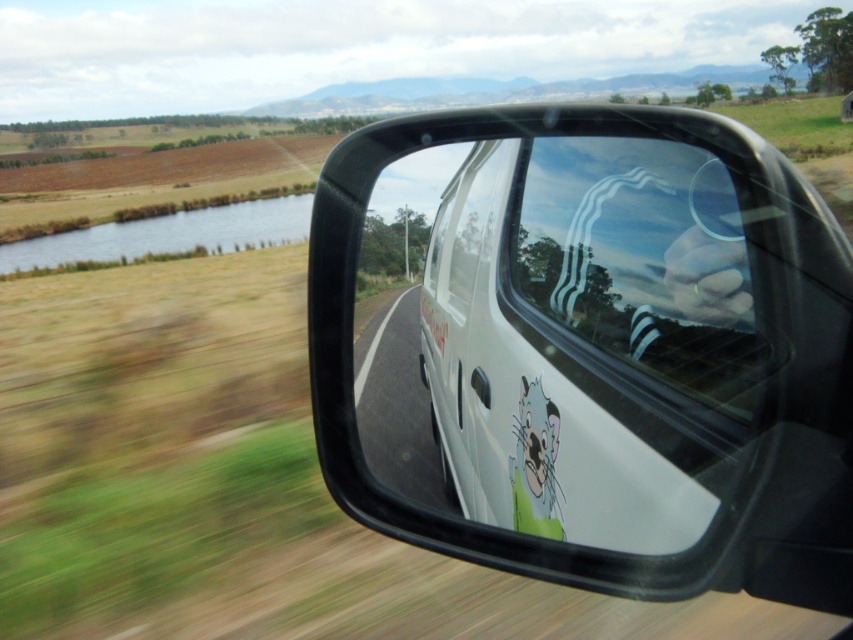
Is clear glass window at center to the right of cartoon cat sticker at lower center from the viewer's perspective?

Indeed, clear glass window at center is positioned on the right side of cartoon cat sticker at lower center.

Which is behind, point (646, 360) or point (527, 406)?

Positioned behind is point (527, 406).

Who is more distant from viewer, (633, 296) or (538, 435)?

The point (538, 435) is more distant.

Locate an element on the screen. clear glass window at center is located at coordinates (643, 260).

Who is lower down, black plastic mirror at center or clear glass window at center?

clear glass window at center

Is black plastic mirror at center positioned before clear glass window at center?

That is True.

Is point (508, 408) more distant than point (674, 330)?

Yes, point (508, 408) is behind point (674, 330).

I want to click on black plastic mirror at center, so click(589, 346).

Is black plastic mirror at center to the left of cartoon cat sticker at lower center from the viewer's perspective?

Incorrect, black plastic mirror at center is not on the left side of cartoon cat sticker at lower center.

Consider the image. Is black plastic mirror at center closer to the viewer compared to cartoon cat sticker at lower center?

Yes, black plastic mirror at center is in front of cartoon cat sticker at lower center.

Locate an element on the screen. black plastic mirror at center is located at coordinates (589, 346).